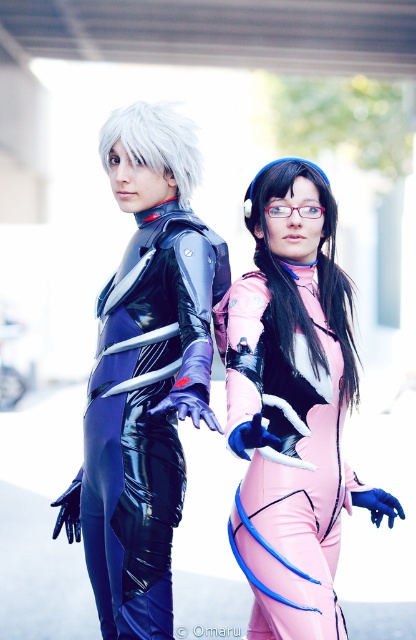
Question: Which point is closer to the camera?

Choices:
 (A) pink matte bodysuit at center
 (B) shiny black bodysuit at center
 (C) glossy black bodysuit at left

Answer: (A)

Question: Estimate the real-world distances between objects in this image. Which object is farther from the glossy black bodysuit at left?

Choices:
 (A) shiny black bodysuit at center
 (B) pink matte bodysuit at center

Answer: (B)

Question: Is shiny black bodysuit at center above glossy black bodysuit at left?

Choices:
 (A) yes
 (B) no

Answer: (A)

Question: Can you confirm if shiny black bodysuit at center is smaller than glossy black bodysuit at left?

Choices:
 (A) yes
 (B) no

Answer: (B)

Question: Can you confirm if pink matte bodysuit at center is thinner than glossy black bodysuit at left?

Choices:
 (A) no
 (B) yes

Answer: (A)

Question: Which object appears closest to the camera in this image?

Choices:
 (A) glossy black bodysuit at left
 (B) shiny black bodysuit at center
 (C) pink matte bodysuit at center

Answer: (C)